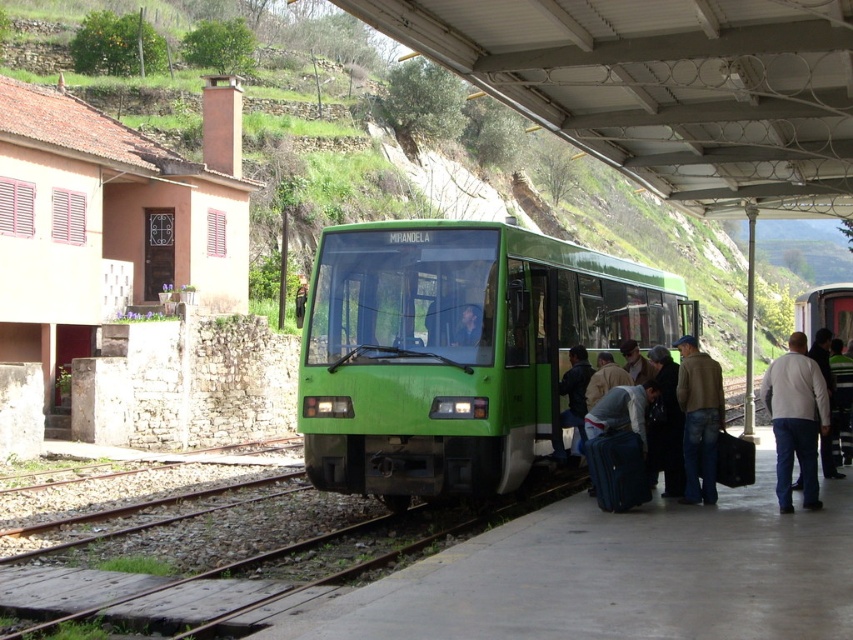
You are a photographer standing at the train station platform. You want to take a photo of the white cotton shirt at right and denim jeans at lower right in the same frame. The minimum distance your camera can focus on two objects simultaneously is 36 inches. Can you capture both in focus without moving?

The white cotton shirt at right and denim jeans at lower right are 38.10 inches apart. Since the distance between them exceeds the camera focus limit of 36 inches, you cannot capture both in focus without moving.

You are a passenger on the platform at the Mirandela train station. You notice a white cotton shirt at right. Where exactly is the white cotton shirt located in relation to the train?

The white cotton shirt at right is located at point 0.656 on the x axis and 0.934 on the y axis relative to the train.